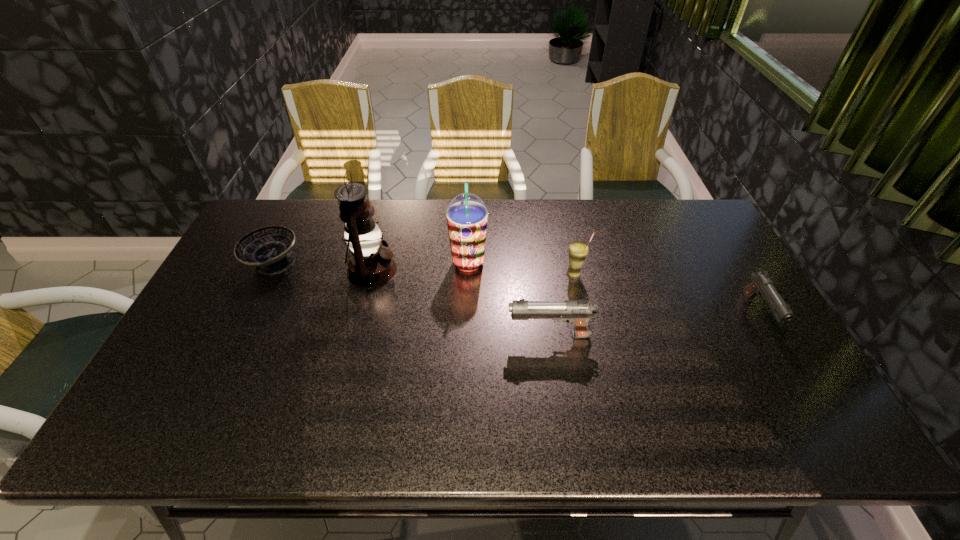
Where is `free point that keeps the guns evenly spaced on the left`? free point that keeps the guns evenly spaced on the left is located at coordinates (322, 358).